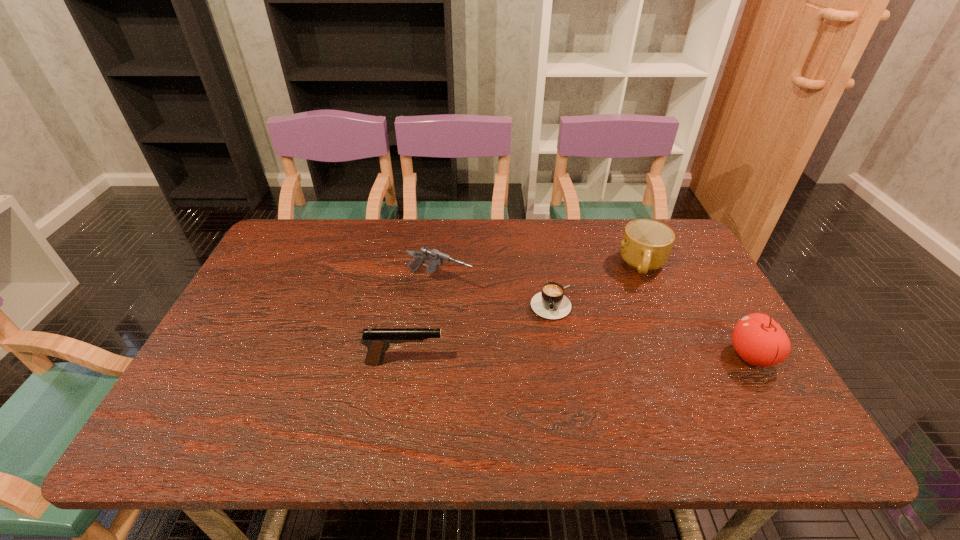
This screenshot has width=960, height=540. Find the location of `object at the far right corner`. object at the far right corner is located at coordinates (646, 245).

Find the location of `free location at the far edge`. free location at the far edge is located at coordinates (532, 261).

Locate an element on the screen. blank area at the near edge is located at coordinates (293, 410).

Locate an element on the screen. free space at the left edge of the desktop is located at coordinates (306, 267).

In the image, there is a desktop. At what (x,y) coordinates should I click in order to perform the action: click on vacant area at the right edge. Please return your answer as a coordinate pair (x, y). Image resolution: width=960 pixels, height=540 pixels. Looking at the image, I should click on (716, 359).

In order to click on vacant area that lies between the pistol and the shortest object in this screenshot , I will do `click(478, 332)`.

At what (x,y) coordinates should I click in order to perform the action: click on empty location between the cappuccino and the gun. Please return your answer as a coordinate pair (x, y). The height and width of the screenshot is (540, 960). Looking at the image, I should click on (495, 293).

You are a GUI agent. You are given a task and a screenshot of the screen. Output one action in this format:
    pyautogui.click(x=<x>, y=<y>)
    Task: Click on the free space between the fourth object from left to right and the third object from right to left
    This screenshot has height=540, width=960.
    Given the screenshot: What is the action you would take?
    pyautogui.click(x=597, y=284)

I want to click on free space between the rightmost object and the pistol, so pos(578,359).

Locate an element on the screen. This screenshot has width=960, height=540. vacant space that is in between the rightmost object and the third object from left to right is located at coordinates (652, 329).